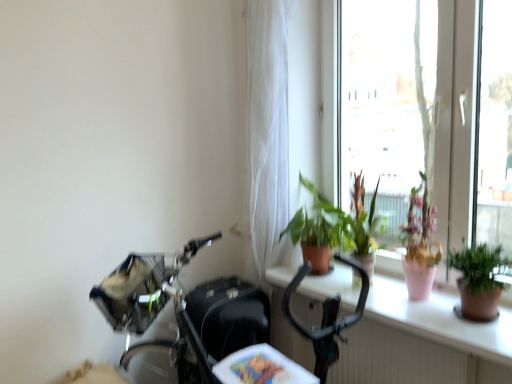
Question: Are white sheer curtain at upper center and green matte plant at upper right, the second houseplant from the right, beside each other?

Choices:
 (A) yes
 (B) no

Answer: (B)

Question: Does white sheer curtain at upper center have a larger size compared to green matte plant at upper right, the second houseplant from the right?

Choices:
 (A) no
 (B) yes

Answer: (B)

Question: Does white sheer curtain at upper center appear on the right side of green matte plant at upper right, the 1th houseplant in the left-to-right sequence?

Choices:
 (A) yes
 (B) no

Answer: (B)

Question: Is white sheer curtain at upper center far away from green matte plant at upper right, the first houseplant when ordered from back to front?

Choices:
 (A) no
 (B) yes

Answer: (A)

Question: Is white sheer curtain at upper center at the left side of green matte plant at upper right, the second houseplant from the right?

Choices:
 (A) yes
 (B) no

Answer: (A)

Question: From the image's perspective, would you say white sheer curtain at upper center is shown under green matte plant at upper right, the second houseplant from the right?

Choices:
 (A) no
 (B) yes

Answer: (A)

Question: Could you tell me if transparent glass window at upper right is facing green matte plant at upper right, which ranks as the second houseplant in front-to-back order?

Choices:
 (A) yes
 (B) no

Answer: (A)

Question: From the image's perspective, is transparent glass window at upper right located beneath green matte plant at upper right, the 1th houseplant in the left-to-right sequence?

Choices:
 (A) no
 (B) yes

Answer: (A)

Question: Is green matte plant at upper right, the 1th houseplant in the left-to-right sequence, at the back of transparent glass window at upper right?

Choices:
 (A) yes
 (B) no

Answer: (A)

Question: Considering the relative sizes of transparent glass window at upper right and green matte plant at upper right, the second houseplant from the right, in the image provided, is transparent glass window at upper right shorter than green matte plant at upper right, the second houseplant from the right,?

Choices:
 (A) no
 (B) yes

Answer: (A)

Question: Is transparent glass window at upper right completely or partially outside of green matte plant at upper right, the 1th houseplant in the left-to-right sequence?

Choices:
 (A) yes
 (B) no

Answer: (A)

Question: Can you confirm if transparent glass window at upper right is taller than green matte plant at upper right, the second houseplant from the right?

Choices:
 (A) no
 (B) yes

Answer: (B)

Question: Does terracotta pot at center appear on the left side of green matte plant at upper right, which appears as the 1th houseplant when viewed from the front?

Choices:
 (A) yes
 (B) no

Answer: (A)